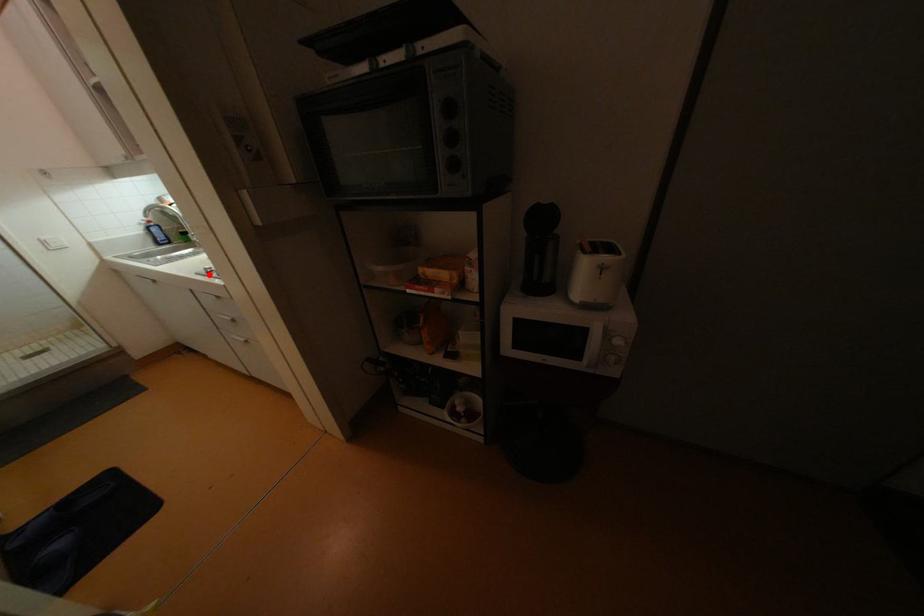
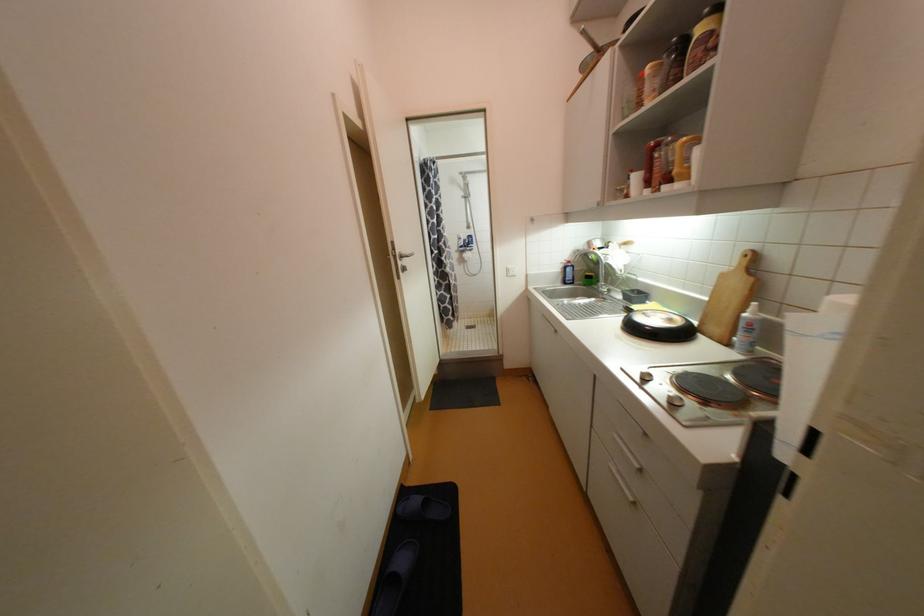
Find the pixel in the second image that matches the highlighted location in the first image.

(642, 379)